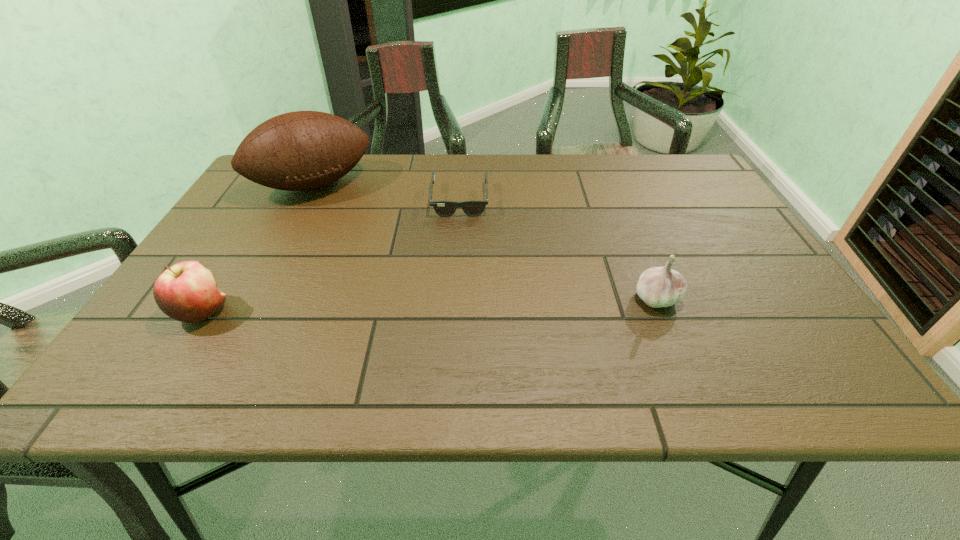
The image size is (960, 540). In the image, there is a desktop. In order to click on free region at the far edge in this screenshot , I will do `click(478, 191)`.

Locate an element on the screen. vacant space at the near edge of the desktop is located at coordinates (549, 331).

I want to click on blank space at the left edge of the desktop, so click(x=284, y=227).

I want to click on free region at the far right corner of the desktop, so click(711, 187).

In order to click on free space between the third object from left to right and the football in this screenshot , I will do `click(387, 192)`.

At what (x,y) coordinates should I click in order to perform the action: click on vacant area between the rightmost object and the tallest object. Please return your answer as a coordinate pair (x, y). Image resolution: width=960 pixels, height=540 pixels. Looking at the image, I should click on (485, 241).

You are a GUI agent. You are given a task and a screenshot of the screen. Output one action in this format:
    pyautogui.click(x=<x>, y=<y>)
    Task: Click on the free space between the apple and the garlic
    The height and width of the screenshot is (540, 960).
    Given the screenshot: What is the action you would take?
    pyautogui.click(x=430, y=305)

This screenshot has height=540, width=960. Identify the location of vacant area that lies between the football and the second object from right to left. (387, 192).

The width and height of the screenshot is (960, 540). I want to click on free space between the sunglasses and the apple, so click(331, 256).

I want to click on vacant space that is in between the sunglasses and the rightmost object, so click(558, 249).